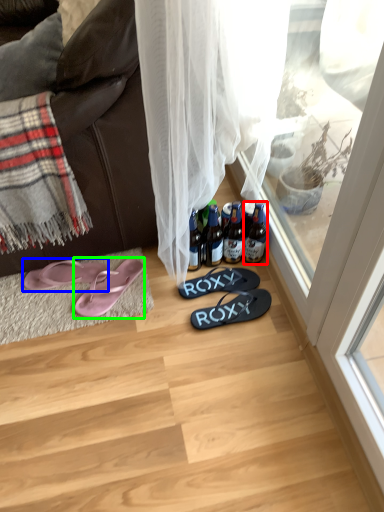
Question: Considering the real-world distances, which object is farthest from bottle (highlighted by a red box)? footwear (highlighted by a blue box) or footwear (highlighted by a green box)?

Choices:
 (A) footwear
 (B) footwear

Answer: (A)